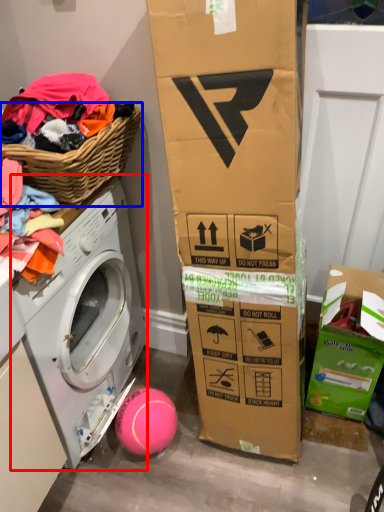
Question: Among these objects, which one is farthest to the camera, washing machine (highlighted by a red box) or basket (highlighted by a blue box)?

Choices:
 (A) washing machine
 (B) basket

Answer: (A)